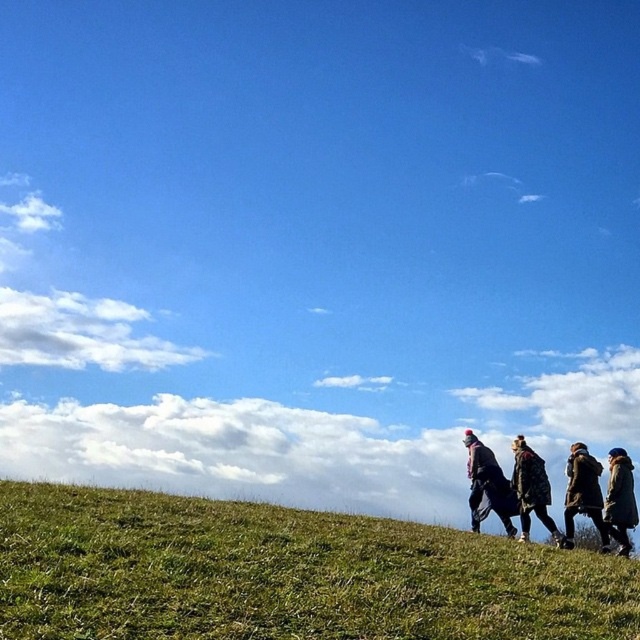
Question: Which point is farther from the camera taking this photo?

Choices:
 (A) (524, 476)
 (B) (632, 488)
 (C) (604, 536)
 (D) (211, 563)

Answer: (A)

Question: Can you confirm if green grassy hillside at lower center is positioned above camouflage jacket at lower right?

Choices:
 (A) no
 (B) yes

Answer: (B)

Question: Which object is farther from the camera taking this photo?

Choices:
 (A) dark brown leather jacket at right
 (B) green grassy hillside at lower center
 (C) dark brown textured coat at lower right
 (D) camouflage jacket at lower right

Answer: (D)

Question: Does green grassy hillside at lower center have a lesser width compared to dark brown leather jacket at right?

Choices:
 (A) yes
 (B) no

Answer: (B)

Question: Can you confirm if dark brown leather jacket at right is positioned to the left of dark brown textured coat at lower right?

Choices:
 (A) no
 (B) yes

Answer: (B)

Question: Which object is positioned closest to the camouflage jacket at lower right?

Choices:
 (A) dark brown leather jacket at right
 (B) green grassy hillside at lower center

Answer: (A)